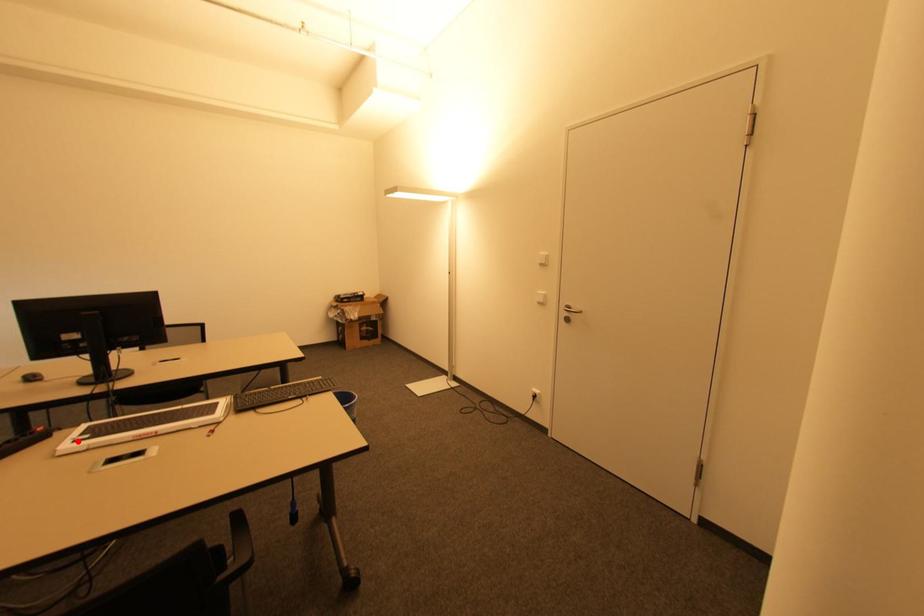
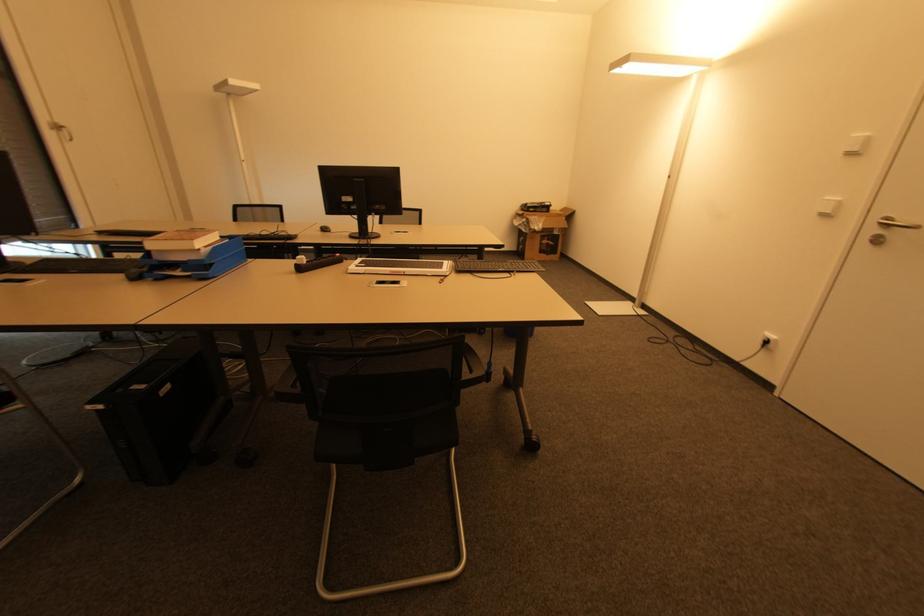
Where in the second image is the point corresponding to the highlighted location from the first image?

(359, 267)